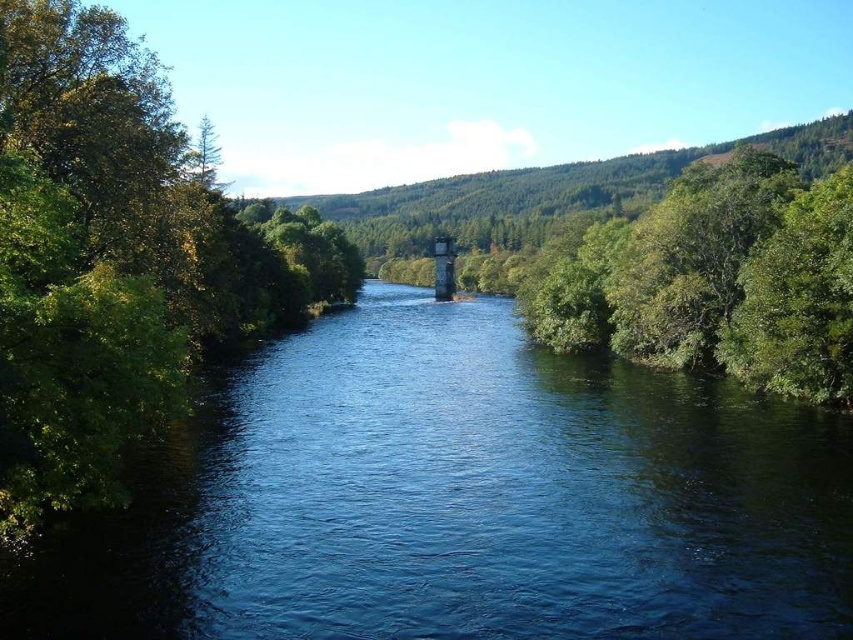
Who is more distant from viewer, [408,604] or [10,472]?

The point [10,472] is behind.

Can you confirm if blue smooth water at center is taller than green leafy tree at left?

In fact, blue smooth water at center may be shorter than green leafy tree at left.

Identify the location of blue smooth water at center. (463, 500).